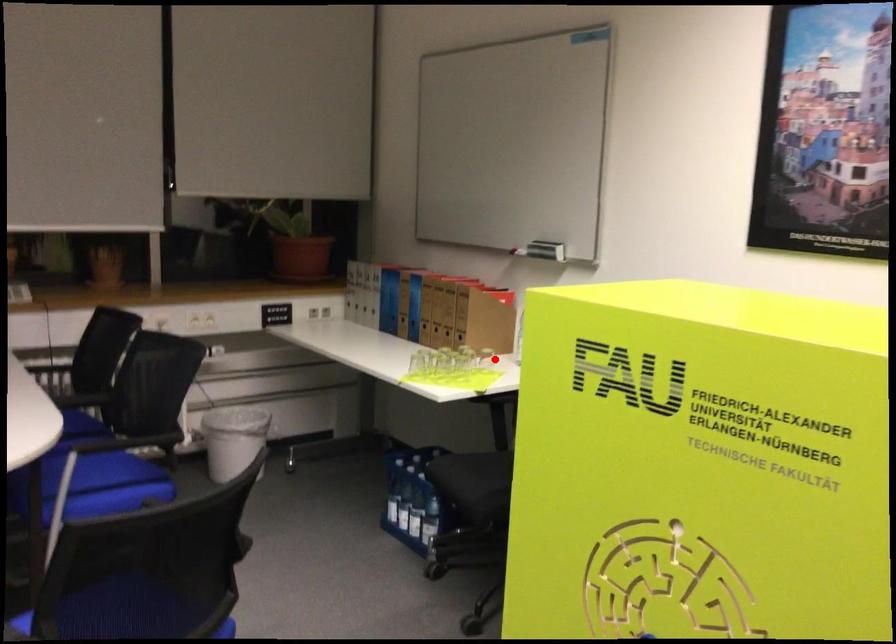
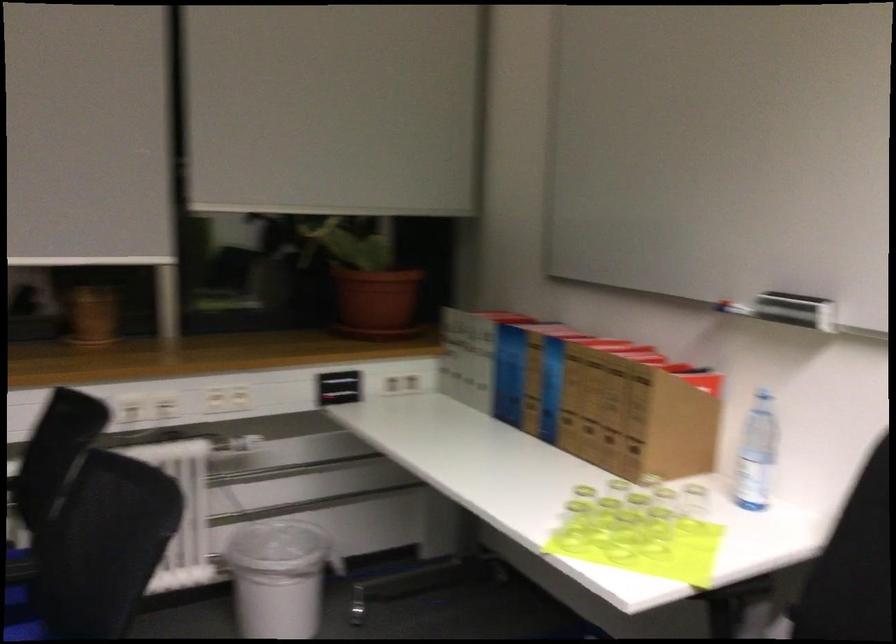
The point at the highlighted location is marked in the first image. Where is the corresponding point in the second image?

(694, 498)